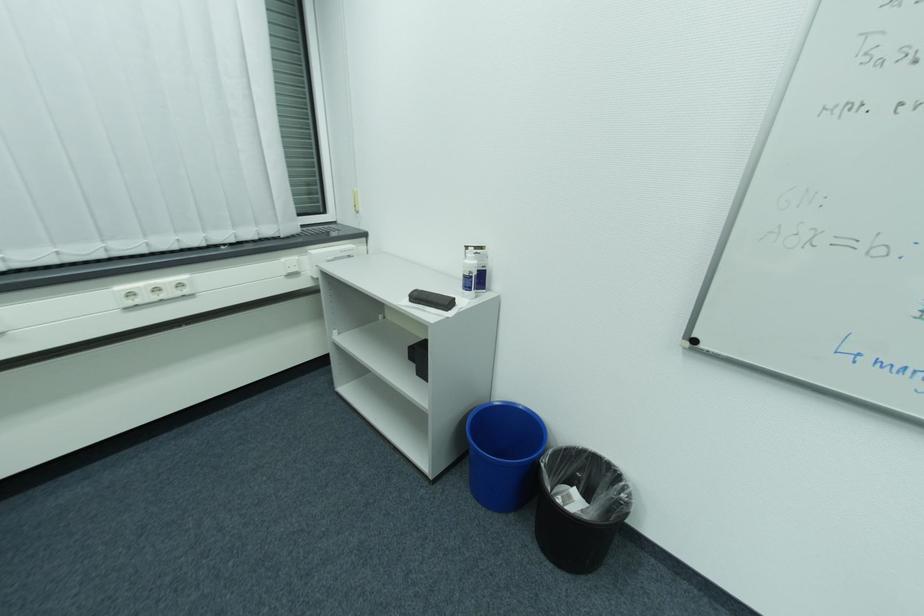
Where would you press the white bottle cap? Please return your answer as a coordinate pair (x, y).

(473, 270)